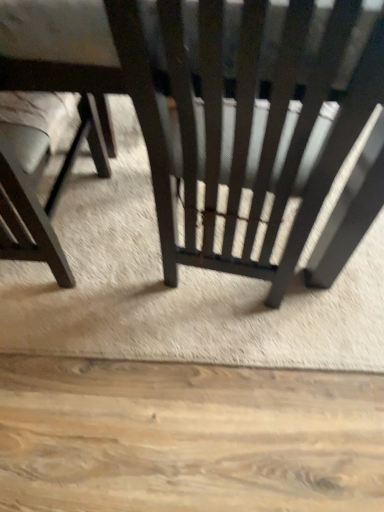
Question: Should I look upward or downward to see matte black chair at center, the 2th chair viewed from the left?

Choices:
 (A) down
 (B) up

Answer: (B)

Question: Is matte black chair at left, the 1th chair from the left, positioned behind matte black chair at center, the 2th chair viewed from the left?

Choices:
 (A) no
 (B) yes

Answer: (B)

Question: Considering the relative sizes of matte black chair at left, arranged as the 2th chair when viewed from the right, and matte black chair at center, the 1th chair positioned from the right, in the image provided, is matte black chair at left, arranged as the 2th chair when viewed from the right, taller than matte black chair at center, the 1th chair positioned from the right,?

Choices:
 (A) no
 (B) yes

Answer: (A)

Question: Is matte black chair at left, arranged as the 2th chair when viewed from the right, positioned with its back to matte black chair at center, the 1th chair positioned from the right?

Choices:
 (A) no
 (B) yes

Answer: (B)

Question: From the image's perspective, does matte black chair at left, arranged as the 2th chair when viewed from the right, appear higher than matte black chair at center, the 1th chair positioned from the right?

Choices:
 (A) yes
 (B) no

Answer: (B)

Question: Can you confirm if matte black chair at left, arranged as the 2th chair when viewed from the right, is positioned to the left of matte black chair at center, the 2th chair viewed from the left?

Choices:
 (A) no
 (B) yes

Answer: (B)

Question: Does matte black chair at left, the 1th chair from the left, have a greater width compared to matte black chair at center, the 2th chair viewed from the left?

Choices:
 (A) no
 (B) yes

Answer: (A)

Question: From a real-world perspective, does matte black chair at center, the 1th chair positioned from the right, sit lower than matte black chair at left, the 1th chair from the left?

Choices:
 (A) no
 (B) yes

Answer: (A)

Question: Does matte black chair at center, the 1th chair positioned from the right, have a lesser width compared to matte black chair at left, the 1th chair from the left?

Choices:
 (A) yes
 (B) no

Answer: (B)

Question: Is matte black chair at center, the 1th chair positioned from the right, to the left of matte black chair at left, arranged as the 2th chair when viewed from the right, from the viewer's perspective?

Choices:
 (A) yes
 (B) no

Answer: (B)

Question: Is matte black chair at center, the 2th chair viewed from the left, further to the viewer compared to matte black chair at left, arranged as the 2th chair when viewed from the right?

Choices:
 (A) yes
 (B) no

Answer: (B)

Question: Considering the relative sizes of matte black chair at center, the 1th chair positioned from the right, and matte black chair at left, the 1th chair from the left, in the image provided, is matte black chair at center, the 1th chair positioned from the right, wider than matte black chair at left, the 1th chair from the left,?

Choices:
 (A) yes
 (B) no

Answer: (A)

Question: Is matte black chair at center, the 1th chair positioned from the right, facing away from matte black chair at left, the 1th chair from the left?

Choices:
 (A) no
 (B) yes

Answer: (A)

Question: Is point (31, 167) positioned closer to the camera than point (203, 246)?

Choices:
 (A) closer
 (B) farther

Answer: (A)